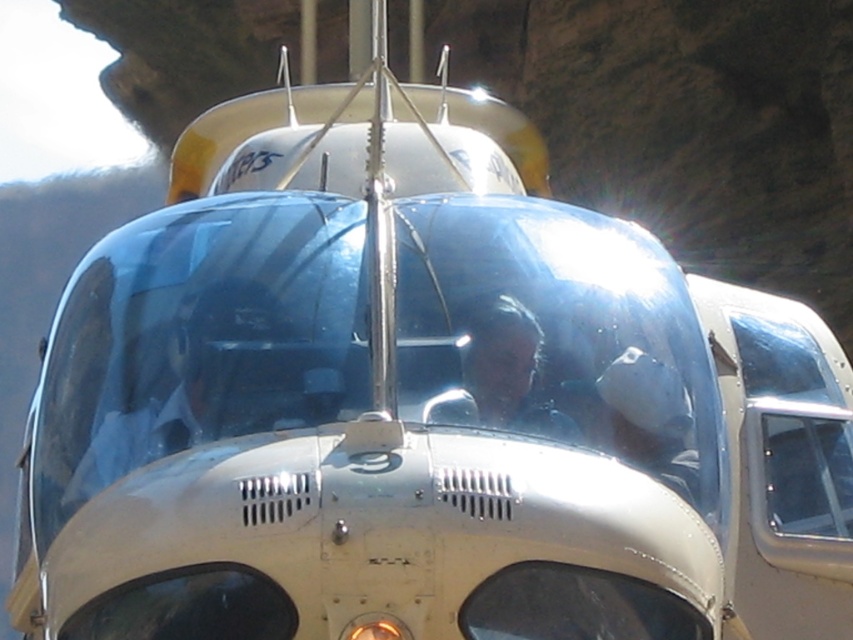
You are a passenger in the helicopter and want to know if the transparent plastic pilot at center can see over the matte black helmet at center. Based on their heights, what do you think?

The transparent plastic pilot at center is much taller than the matte black helmet at center, so the pilot can see over the matte black helmet at center.

You are standing on the ground and see the transparent plastic pilot at center in the helicopter cockpit. If you want to throw a ball to the pilot, will it reach them if you can throw up to 75 feet?

The distance between you and the transparent plastic pilot at center is 74.60 feet, which is within your throwing range of 75 feet. Therefore, the ball will reach the pilot.

You are a passenger in the helicopter and want to hand a document to the transparent plastic pilot at center. You notice a matte black helmet at center nearby. Which object is closer to you so you can reach it first?

The transparent plastic pilot at center is closer to the viewer than the matte black helmet at center, so you can reach the transparent plastic pilot at center first.